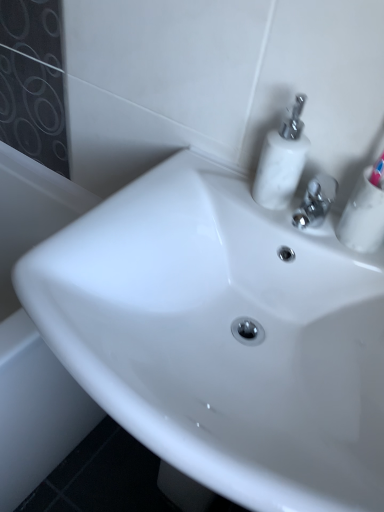
Question: Considering the relative sizes of white glossy soap dispenser at upper right and white glossy mouthwash at upper right in the image provided, is white glossy soap dispenser at upper right taller than white glossy mouthwash at upper right?

Choices:
 (A) yes
 (B) no

Answer: (A)

Question: From the image's perspective, is white glossy soap dispenser at upper right on white glossy mouthwash at upper right?

Choices:
 (A) no
 (B) yes

Answer: (B)

Question: Is white glossy soap dispenser at upper right completely or partially outside of white glossy mouthwash at upper right?

Choices:
 (A) no
 (B) yes

Answer: (B)

Question: Is the position of white glossy soap dispenser at upper right more distant than that of white glossy mouthwash at upper right?

Choices:
 (A) yes
 (B) no

Answer: (A)

Question: Is white glossy soap dispenser at upper right facing away from white glossy mouthwash at upper right?

Choices:
 (A) yes
 (B) no

Answer: (B)

Question: Is white glossy mouthwash at upper right to the left or to the right of white glossy bath at lower left in the image?

Choices:
 (A) left
 (B) right

Answer: (B)

Question: Is point (375, 244) closer or farther from the camera than point (43, 192)?

Choices:
 (A) closer
 (B) farther

Answer: (A)

Question: Do you think white glossy mouthwash at upper right is within white glossy bath at lower left, or outside of it?

Choices:
 (A) inside
 (B) outside

Answer: (B)

Question: Looking at the image, does white glossy mouthwash at upper right seem bigger or smaller compared to white glossy bath at lower left?

Choices:
 (A) small
 (B) big

Answer: (A)

Question: Considering the positions of white glossy sink at center and white glossy mouthwash at upper right in the image, is white glossy sink at center taller or shorter than white glossy mouthwash at upper right?

Choices:
 (A) short
 (B) tall

Answer: (B)

Question: Relative to white glossy mouthwash at upper right, is white glossy sink at center in front or behind?

Choices:
 (A) front
 (B) behind

Answer: (A)

Question: Considering the relative positions of white glossy sink at center and white glossy mouthwash at upper right in the image provided, is white glossy sink at center to the left or to the right of white glossy mouthwash at upper right?

Choices:
 (A) right
 (B) left

Answer: (B)

Question: From the image's perspective, is white glossy sink at center positioned above or below white glossy mouthwash at upper right?

Choices:
 (A) above
 (B) below

Answer: (B)

Question: Is white glossy mouthwash at upper right taller or shorter than white glossy soap dispenser at upper right?

Choices:
 (A) short
 (B) tall

Answer: (A)

Question: Is white glossy mouthwash at upper right in front of or behind white glossy soap dispenser at upper right in the image?

Choices:
 (A) front
 (B) behind

Answer: (A)